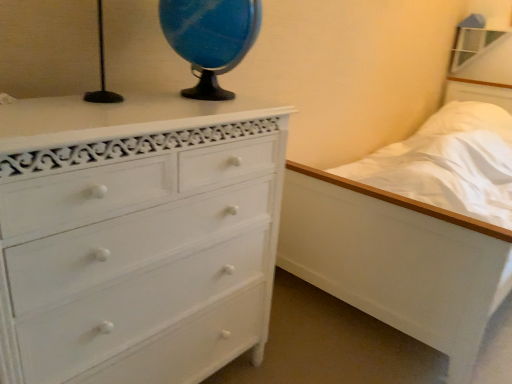
Question: Is white painted wood chest of drawers at left shorter than blue marble globe at upper center?

Choices:
 (A) yes
 (B) no

Answer: (B)

Question: Is white painted wood chest of drawers at left directly adjacent to blue marble globe at upper center?

Choices:
 (A) yes
 (B) no

Answer: (B)

Question: From the image's perspective, is white painted wood chest of drawers at left over blue marble globe at upper center?

Choices:
 (A) no
 (B) yes

Answer: (A)

Question: Does white painted wood chest of drawers at left come in front of blue marble globe at upper center?

Choices:
 (A) yes
 (B) no

Answer: (A)

Question: Are white painted wood chest of drawers at left and blue marble globe at upper center located far from each other?

Choices:
 (A) no
 (B) yes

Answer: (A)

Question: Can blue marble globe at upper center be found inside white painted wood chest of drawers at left?

Choices:
 (A) no
 (B) yes

Answer: (A)

Question: Considering the relative positions of white wooden bed at right and blue marble globe at upper center in the image provided, is white wooden bed at right to the left of blue marble globe at upper center from the viewer's perspective?

Choices:
 (A) yes
 (B) no

Answer: (B)

Question: Is white wooden bed at right oriented away from blue marble globe at upper center?

Choices:
 (A) yes
 (B) no

Answer: (B)

Question: Considering the relative sizes of white wooden bed at right and blue marble globe at upper center in the image provided, is white wooden bed at right taller than blue marble globe at upper center?

Choices:
 (A) no
 (B) yes

Answer: (B)

Question: Is white wooden bed at right further to the viewer compared to blue marble globe at upper center?

Choices:
 (A) no
 (B) yes

Answer: (B)

Question: From a real-world perspective, is white wooden bed at right physically below blue marble globe at upper center?

Choices:
 (A) yes
 (B) no

Answer: (A)

Question: From the image's perspective, is white wooden bed at right beneath blue marble globe at upper center?

Choices:
 (A) yes
 (B) no

Answer: (A)

Question: Is blue marble globe at upper center aimed at white painted wood chest of drawers at left?

Choices:
 (A) no
 (B) yes

Answer: (A)